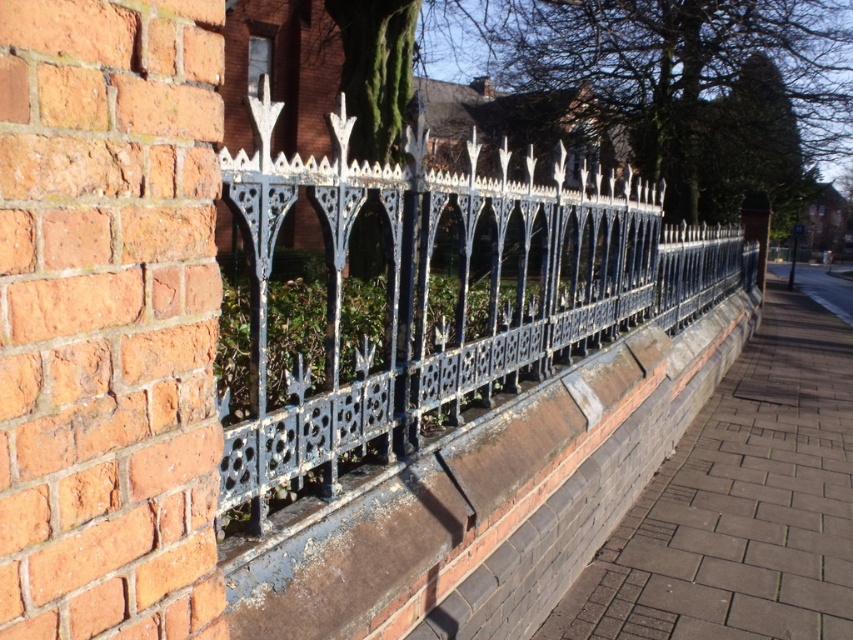
Who is more forward, [427,330] or [788,589]?

Point [427,330] is in front.

Between blue wrought iron fence at center and gray brick pavement at lower right, which one appears on the left side from the viewer's perspective?

blue wrought iron fence at center is more to the left.

What do you see at coordinates (433, 301) in the screenshot?
I see `blue wrought iron fence at center` at bounding box center [433, 301].

Locate an element on the screen. This screenshot has width=853, height=640. blue wrought iron fence at center is located at coordinates (433, 301).

Does black brick ledge at center appear under gray brick pavement at lower right?

Indeed, black brick ledge at center is positioned under gray brick pavement at lower right.

Describe the element at coordinates (495, 502) in the screenshot. The image size is (853, 640). I see `black brick ledge at center` at that location.

Describe the element at coordinates (495, 502) in the screenshot. I see `black brick ledge at center` at that location.

Identify the location of black brick ledge at center. The height and width of the screenshot is (640, 853). (495, 502).

Is blue wrought iron fence at center smaller than black brick ledge at center?

Correct, blue wrought iron fence at center occupies less space than black brick ledge at center.

How far apart are blue wrought iron fence at center and black brick ledge at center?

blue wrought iron fence at center and black brick ledge at center are 25.51 feet apart from each other.

At what (x,y) coordinates should I click in order to perform the action: click on blue wrought iron fence at center. Please return your answer as a coordinate pair (x, y). This screenshot has height=640, width=853. Looking at the image, I should click on (433, 301).